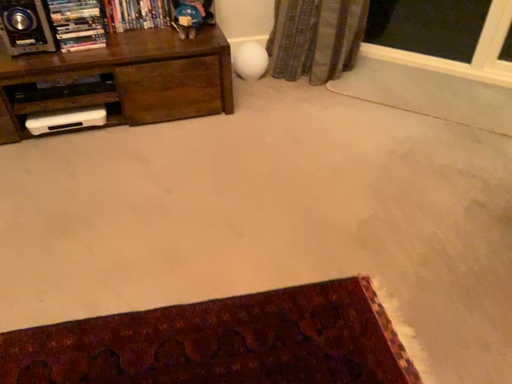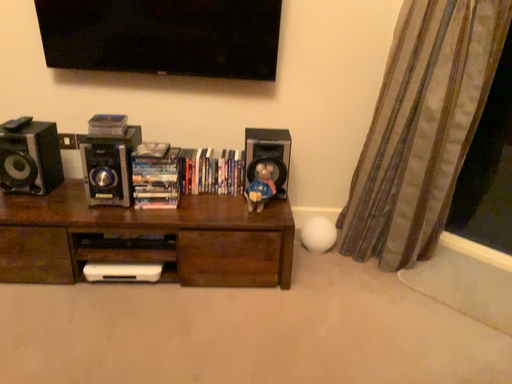
Question: Which way did the camera rotate in the video?

Choices:
 (A) rotated downward
 (B) rotated upward

Answer: (B)